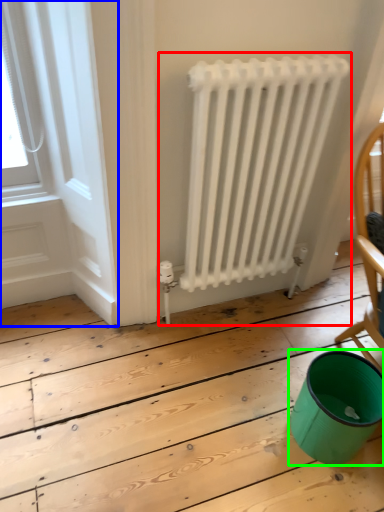
Question: Which object is the farthest from radiator (highlighted by a red box)? Choose among these: window frame (highlighted by a blue box) or teal (highlighted by a green box).

Choices:
 (A) window frame
 (B) teal

Answer: (B)